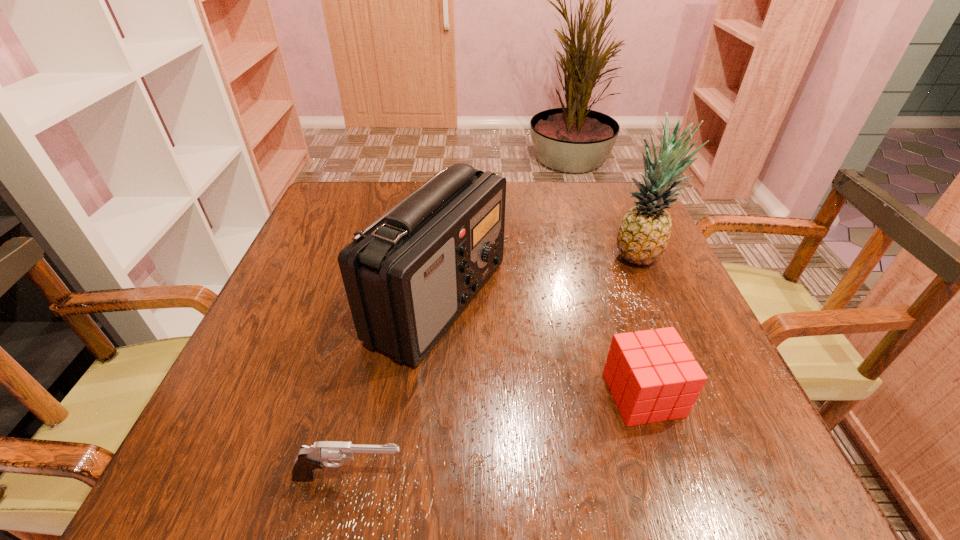
Select which object appears as the closest to the radio receiver. Please provide its 2D coordinates. Your answer should be formatted as a tuple, i.e. [(x, y)], where the tuple contains the x and y coordinates of a point satisfying the conditions above.

[(653, 376)]

Find the location of a particular element. object that is the closest to the nearest object is located at coordinates (408, 276).

Where is `vacant point that satisfies the following two spatial constraints: 1. on the front side of the pineapple; 2. on the front panel of the radio receiver`? vacant point that satisfies the following two spatial constraints: 1. on the front side of the pineapple; 2. on the front panel of the radio receiver is located at coordinates (657, 300).

Find the location of a particular element. The image size is (960, 540). vacant space that satisfies the following two spatial constraints: 1. on the back side of the cube; 2. on the right side of the tallest object is located at coordinates (598, 256).

Where is `vacant space that satisfies the following two spatial constraints: 1. on the front side of the cube; 2. at the muzzle of the gun`? vacant space that satisfies the following two spatial constraints: 1. on the front side of the cube; 2. at the muzzle of the gun is located at coordinates (669, 477).